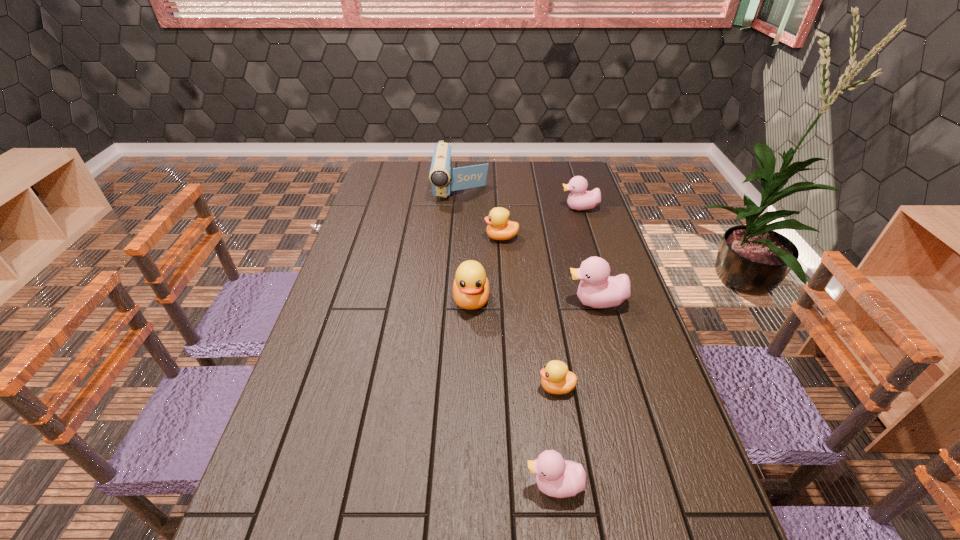
The image size is (960, 540). In the image, there is a desktop. Find the location of `vacant space at the left edge`. vacant space at the left edge is located at coordinates (392, 221).

The width and height of the screenshot is (960, 540). In the image, there is a desktop. In order to click on vacant space at the right edge in this screenshot , I will do `click(628, 380)`.

Image resolution: width=960 pixels, height=540 pixels. I want to click on vacant area that lies between the second nearest pink duckling and the camcorder, so click(x=529, y=245).

You are a GUI agent. You are given a task and a screenshot of the screen. Output one action in this format:
    pyautogui.click(x=<x>, y=<y>)
    Task: Click on the free space between the nearest object and the second biggest yellow duckling
    The width and height of the screenshot is (960, 540).
    Given the screenshot: What is the action you would take?
    pyautogui.click(x=528, y=361)

Locate an element on the screen. free spot between the biggest yellow duckling and the farthest yellow duckling is located at coordinates (487, 269).

Where is `free point between the second biggest yellow duckling and the second nearest yellow duckling`? free point between the second biggest yellow duckling and the second nearest yellow duckling is located at coordinates (487, 269).

I want to click on unoccupied area between the second nearest pink duckling and the farthest duckling, so click(x=588, y=255).

I want to click on vacant area that lies between the farthest pink duckling and the farthest yellow duckling, so click(x=540, y=222).

Where is `vacant area that lies between the biggest pink duckling and the sixth farthest object`? This screenshot has height=540, width=960. vacant area that lies between the biggest pink duckling and the sixth farthest object is located at coordinates 576,345.

Locate an element on the screen. The height and width of the screenshot is (540, 960). free point between the farthest duckling and the third farthest object is located at coordinates (540, 222).